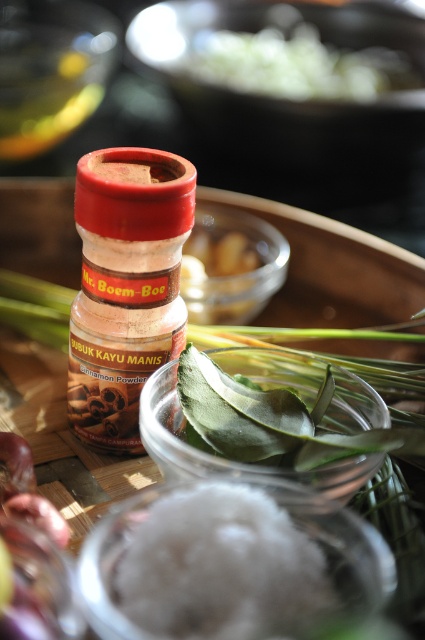
You are a chef trying to locate two specific points in the kitchen scene. The first point is at coordinates point (206, 355), and the second is at point (272, 61). From your perspective, which point is closer to you?

Point (206, 355) is in front of point (272, 61), so the first point is closer to you.

Please provide the 2D coordinates of the white fluffy powder at center in the image. The answer should be in the format of a point with two decimal places, like this example format point format example. Please ensure that the coordinates are derived from the provided description and not from any assumptions beyond the given information.

The 2D coordinates of the white fluffy powder at center are at point (221, 566).